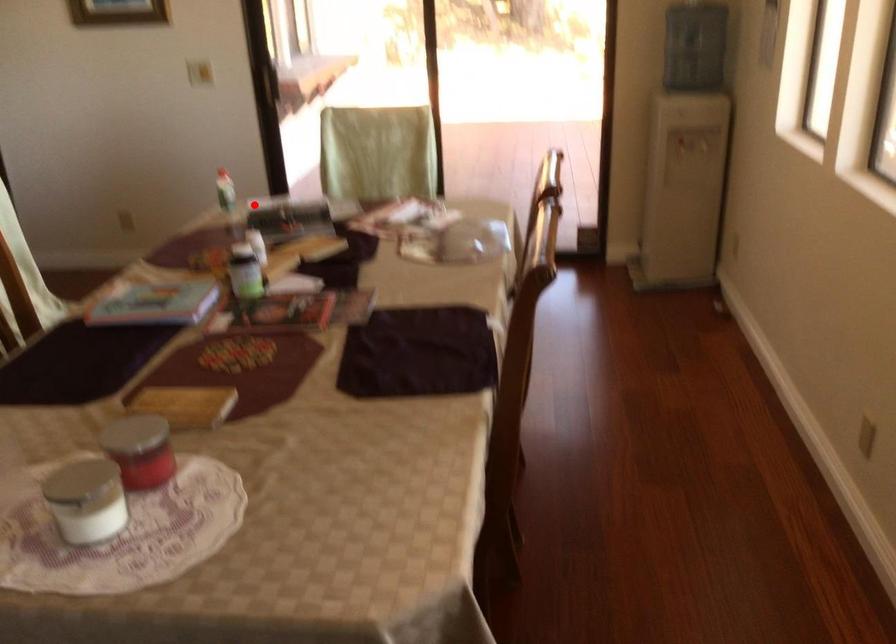
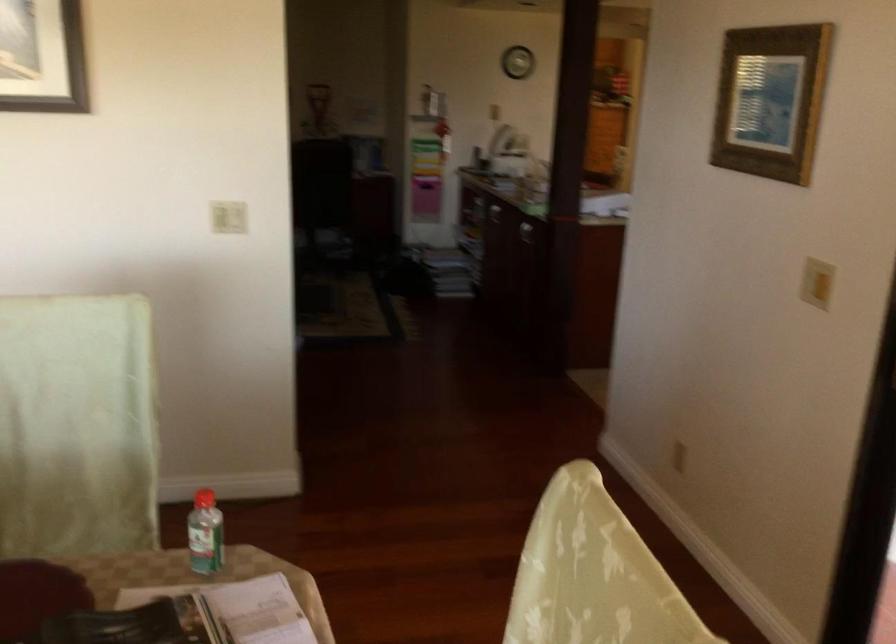
Question: I am providing you with two images of the same scene from different viewpoints. Given a red point in image1, look at the same physical point in image2. Is it:

Choices:
 (A) Closer to the viewpoint
 (B) Farther from the viewpoint

Answer: (A)